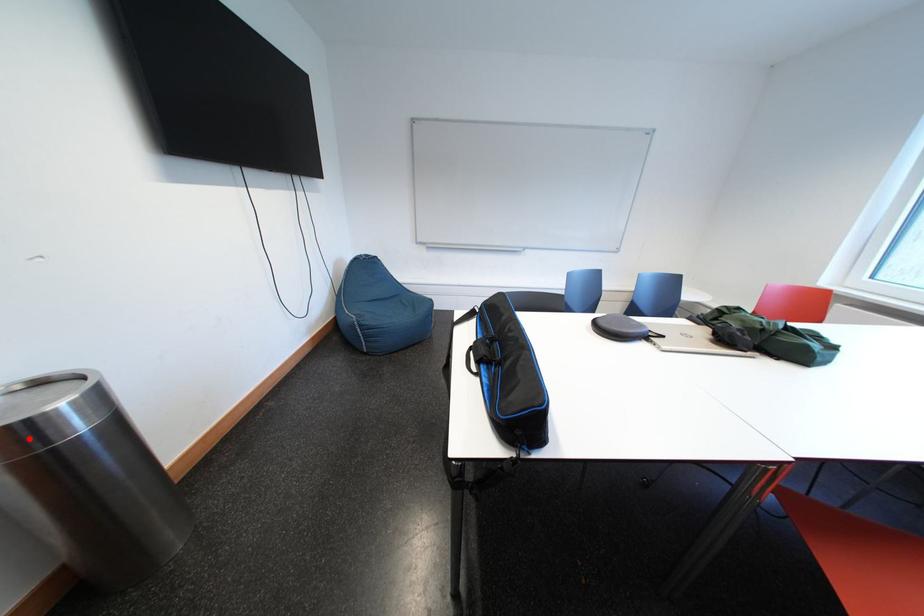
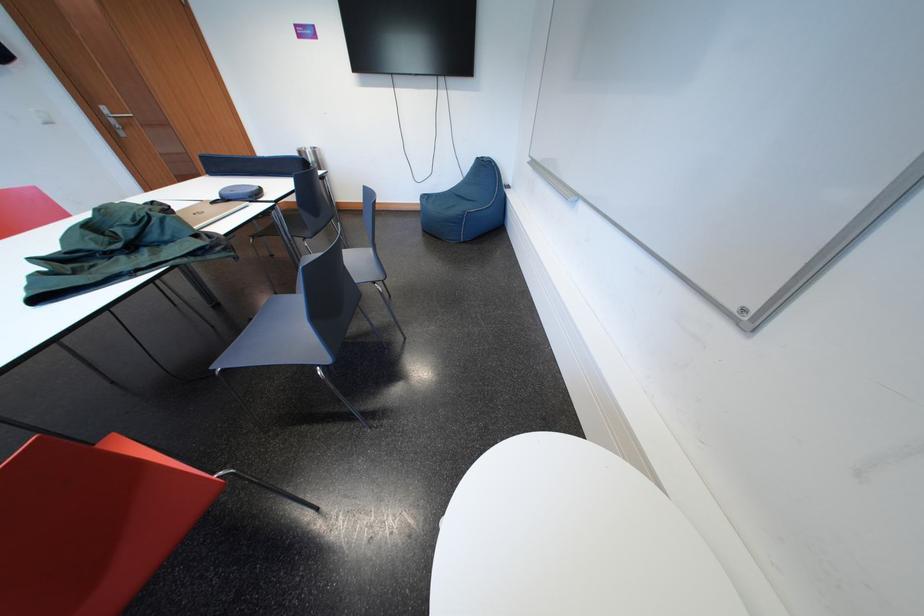
Find the pixel in the second image that matches the highlighted location in the first image.

(309, 158)